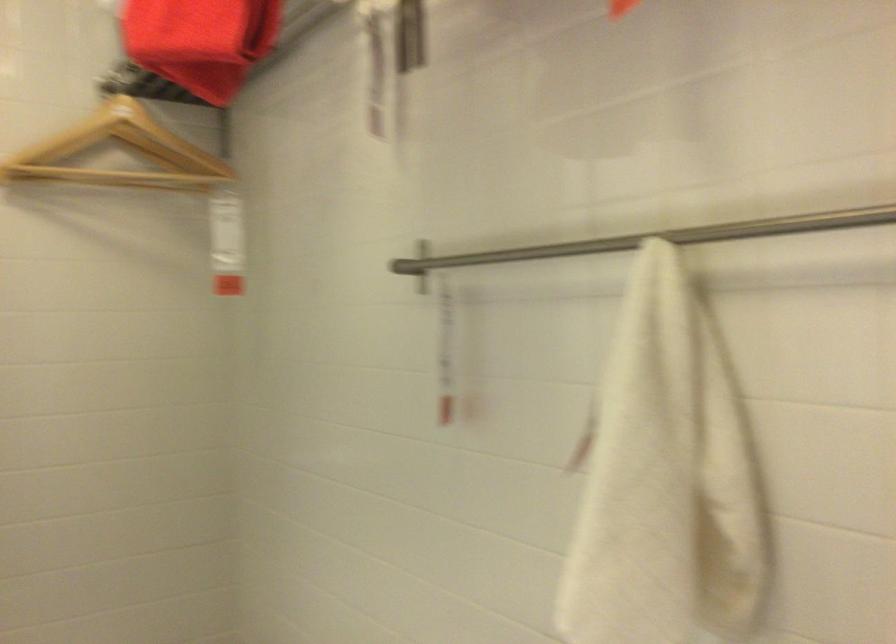
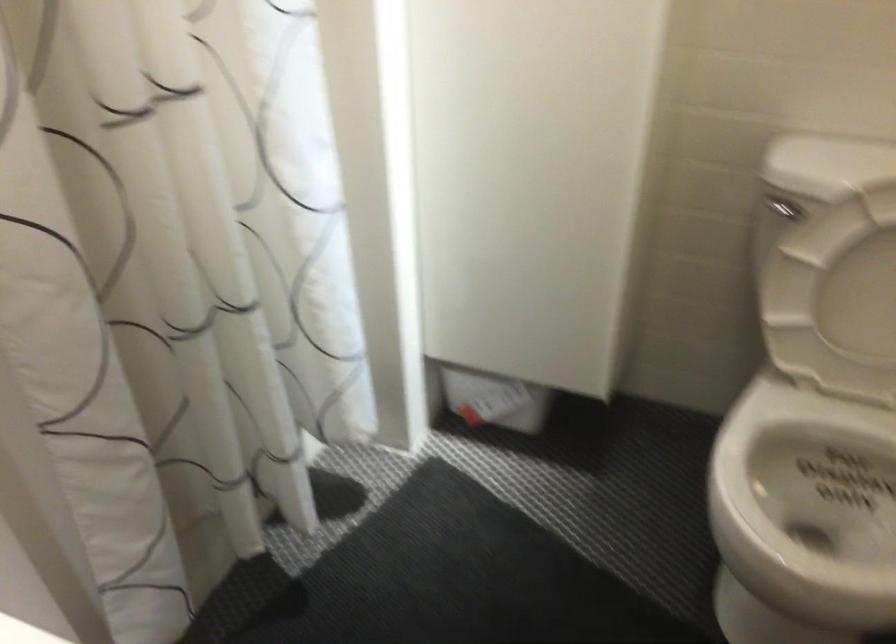
How did the camera likely rotate?

The camera's rotation is toward left-down.